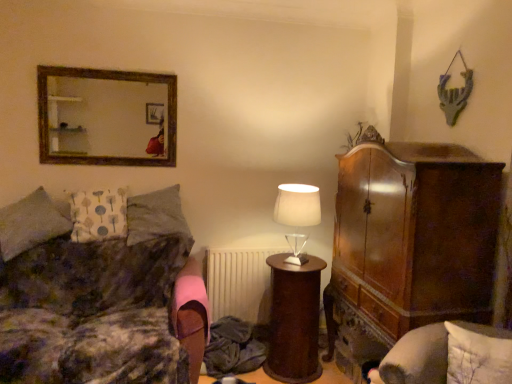
Question: Is point (48, 203) positioned closer to the camera than point (271, 324)?

Choices:
 (A) closer
 (B) farther

Answer: (A)

Question: Looking at the image, does white fabric pillow at left, the 1th pillow from the left, seem bigger or smaller compared to brown polished wood side table at center?

Choices:
 (A) small
 (B) big

Answer: (B)

Question: Estimate the real-world distances between objects in this image. Which object is closer to the pink fabric swivel chair at lower center, the 2th swivel chair positioned from the right?

Choices:
 (A) white textured pillow at lower right, which is counted as the 1th pillow, starting from the right
 (B) white fabric pillow at left, which is the 3th pillow from right to left
 (C) velvet gray swivel chair at lower right, which is the first swivel chair in front-to-back order
 (D) brown polished wood side table at center
 (E) wooden frame mirror at upper left

Answer: (D)

Question: Which object is positioned closest to the gray fabric pillow at left, acting as the 3th pillow starting from the left?

Choices:
 (A) velvet-like brown couch at left
 (B) white matte table lamp at center
 (C) white fabric pillow at left, placed as the 2th pillow when sorted from left to right
 (D) brown polished wood side table at center
 (E) wooden frame mirror at upper left

Answer: (C)